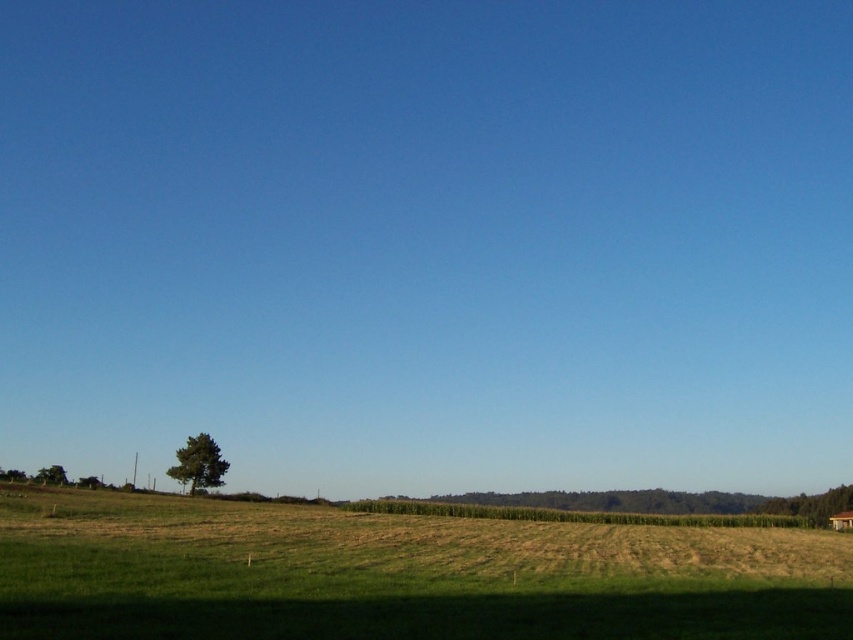
Question: Among these points, which one is nearest to the camera?

Choices:
 (A) (372, 632)
 (B) (213, 440)

Answer: (A)

Question: Is green textured tree at lower left bigger than green leafy tree at lower left?

Choices:
 (A) yes
 (B) no

Answer: (B)

Question: Can you confirm if green grassy field at lower center is smaller than green leafy tree at lower left?

Choices:
 (A) yes
 (B) no

Answer: (A)

Question: In this image, where is green grassy field at lower center located relative to green leafy tree at lower left?

Choices:
 (A) above
 (B) below

Answer: (A)

Question: Which object is closer to the camera taking this photo?

Choices:
 (A) green textured tree at lower left
 (B) green grassy field at lower center
 (C) green leafy tree at lower left

Answer: (B)

Question: Which point is closer to the camera taking this photo?

Choices:
 (A) (202, 472)
 (B) (59, 474)

Answer: (A)